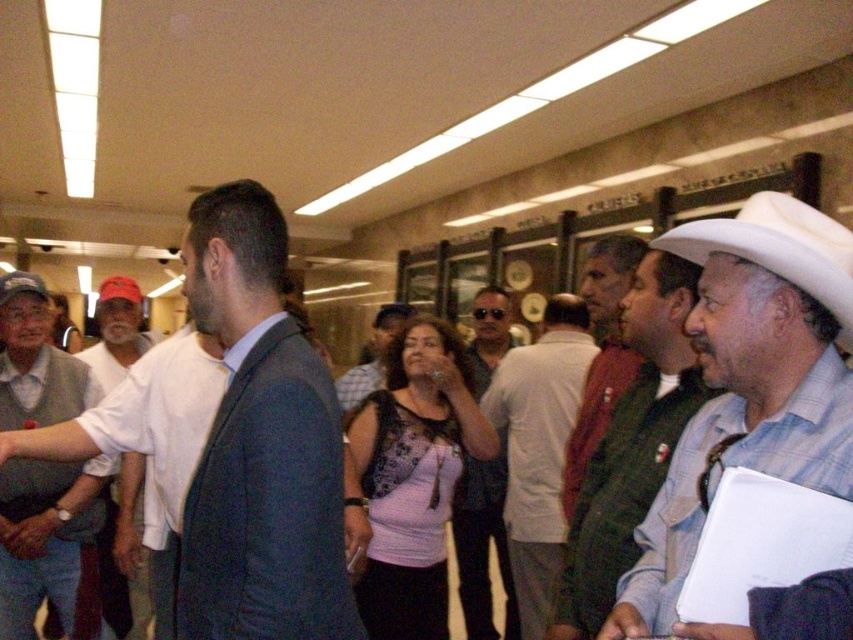
Measure the distance between white felt cowboy hat at right and matte gray shirt at center.

white felt cowboy hat at right is 1.92 meters away from matte gray shirt at center.

Does point (717, 236) come closer to viewer compared to point (459, 563)?

Yes.

The height and width of the screenshot is (640, 853). Find the location of `white felt cowboy hat at right`. white felt cowboy hat at right is located at coordinates (779, 248).

Which is more to the right, white matte hat at right or white cotton shirt at left?

white matte hat at right is more to the right.

Is white matte hat at right bigger than white cotton shirt at left?

Correct, white matte hat at right is larger in size than white cotton shirt at left.

The width and height of the screenshot is (853, 640). I want to click on white matte hat at right, so click(749, 387).

Can you confirm if dark gray suit at center is positioned below white cotton shirt at left?

Incorrect, dark gray suit at center is not positioned below white cotton shirt at left.

Who is lower down, dark gray suit at center or white cotton shirt at left?

white cotton shirt at left is lower down.

At what (x,y) coordinates should I click in order to perform the action: click on dark gray suit at center. Please return your answer as a coordinate pair (x, y). The image size is (853, 640). Looking at the image, I should click on (260, 444).

I want to click on dark gray suit at center, so click(x=260, y=444).